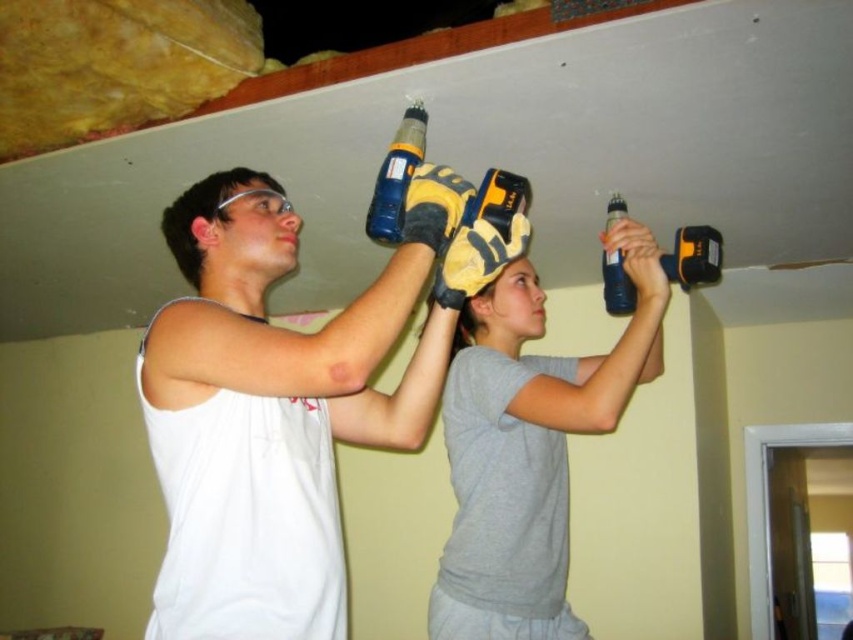
You are standing at the entrance of the room and want to reach the point marked at coordinates point (x=474, y=385). The doorway is 3 feet wide. Can you walk through the doorway to reach that point?

The distance of point (x=474, y=385) from viewer is 5.13 feet. Since the doorway is 3 feet wide, you can walk through the doorway to reach the point as the width of the doorway is sufficient for passage.

You are a safety inspector checking the workspace. You notice the blue plastic drill at upper right and the translucent plastic bottle at upper center. According to safety regulations, which object is positioned in a safer location relative to the other?

The blue plastic drill at upper right is above the translucent plastic bottle at upper center. Since the drill is higher up, it is less likely to accidentally fall and hit the bottle, making its position safer.

You are a safety inspector checking the work area. You notice the white matte tank top at center and the translucent plastic bottle at upper center. Which object is positioned closer to you?

The white matte tank top at center is closer to the viewer than the translucent plastic bottle at upper center.